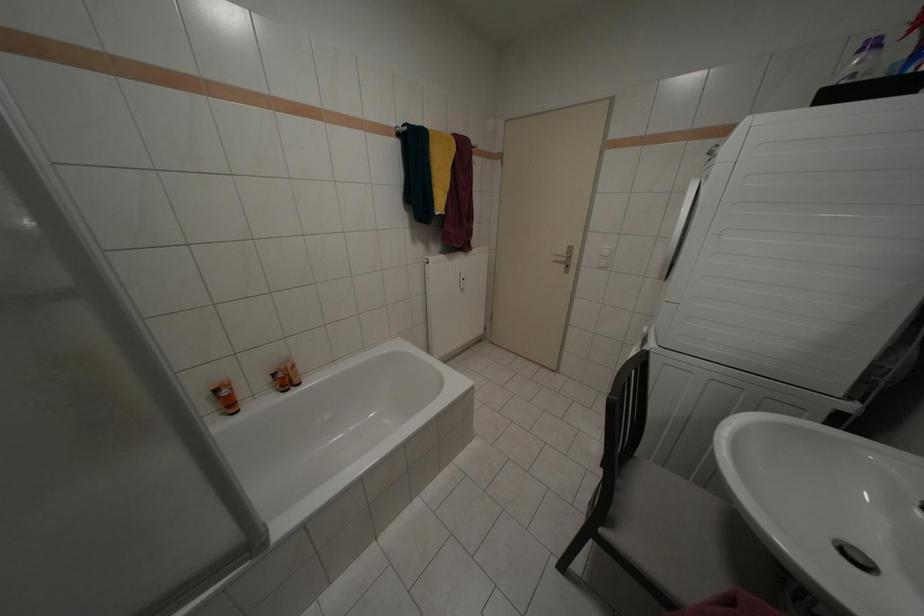
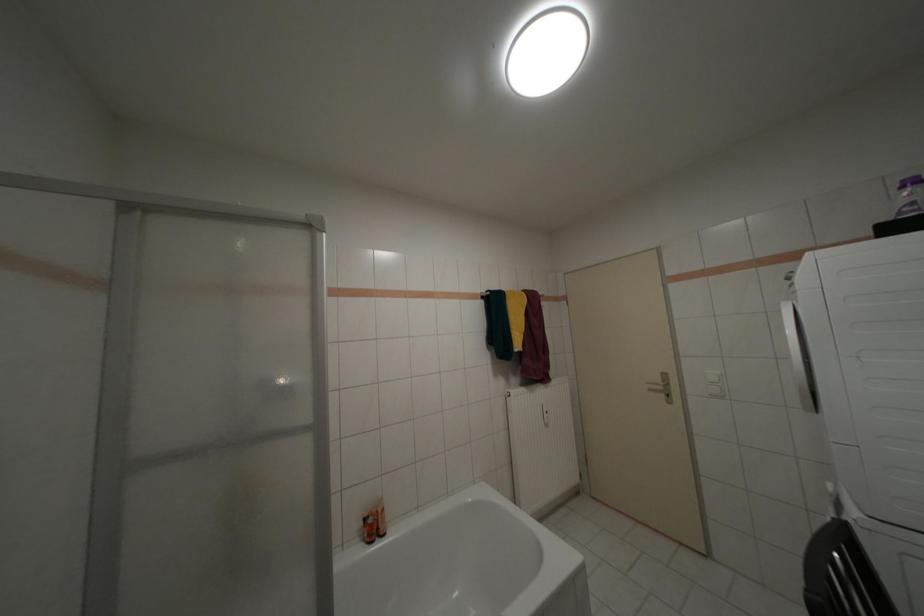
How did the camera likely rotate?

The camera's rotation is toward left-up.